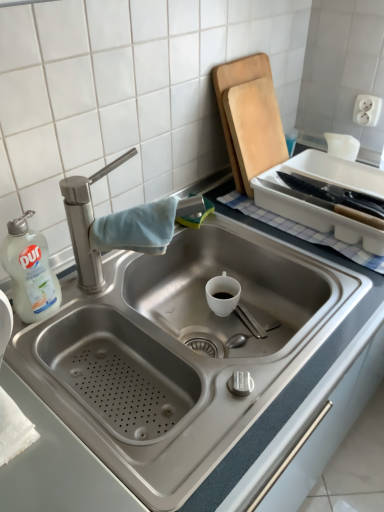
Based on the photo, measure the distance between point (201, 188) and camera.

A distance of 1.21 meters exists between point (201, 188) and camera.

What is the approximate height of white plastic tray at upper right?

white plastic tray at upper right is 3.71 inches tall.

Identify the location of white plastic tray at upper right. (319, 206).

The width and height of the screenshot is (384, 512). Describe the element at coordinates (30, 271) in the screenshot. I see `white plastic bottle at left` at that location.

What do you see at coordinates (249, 117) in the screenshot? I see `wooden cutting board at upper right` at bounding box center [249, 117].

Where is `stainless steel sink at center`? This screenshot has height=512, width=384. stainless steel sink at center is located at coordinates (196, 355).

Would you say white plastic bottle at left is part of wooden cutting board at upper right's contents?

No.

Is wooden cutting board at upper right facing towards white plastic bottle at left?

No, wooden cutting board at upper right does not turn towards white plastic bottle at left.

Looking at this image, in terms of height, does wooden cutting board at upper right look taller or shorter compared to white plastic bottle at left?

Clearly, wooden cutting board at upper right is taller compared to white plastic bottle at left.

The width and height of the screenshot is (384, 512). I want to click on cleaning product below the white plastic tray at upper right (from the image's perspective), so click(x=30, y=271).

Is white plastic bottle at left placed right next to white plastic tray at upper right?

No, white plastic bottle at left is not next to white plastic tray at upper right.

Looking at this image, is white plastic bottle at left looking in the opposite direction of white plastic tray at upper right?

white plastic bottle at left is not turned away from white plastic tray at upper right.

Considering the sizes of objects white plastic bottle at left and white plastic tray at upper right in the image provided, who is shorter, white plastic bottle at left or white plastic tray at upper right?

white plastic tray at upper right.

Is point (71, 335) less distant than point (233, 139)?

Yes, point (71, 335) is closer to viewer.

Considering the sizes of objects stainless steel sink at center and wooden cutting board at upper right in the image provided, who is shorter, stainless steel sink at center or wooden cutting board at upper right?

stainless steel sink at center is shorter.

Does stainless steel sink at center have a lesser width compared to wooden cutting board at upper right?

In fact, stainless steel sink at center might be wider than wooden cutting board at upper right.

Considering the points (314, 149) and (251, 152), which point is behind, point (314, 149) or point (251, 152)?

The point (314, 149) is more distant.

You are a GUI agent. You are given a task and a screenshot of the screen. Output one action in this format:
    pyautogui.click(x=<x>, y=<y>)
    Task: Click on the cutting board behind the white plastic tray at upper right
    
    Given the screenshot: What is the action you would take?
    (249, 117)

From a real-world perspective, between white plastic tray at upper right and wooden cutting board at upper right, who is vertically lower?

white plastic tray at upper right, from a real-world perspective.

Does white plastic tray at upper right appear on the right side of wooden cutting board at upper right?

Yes, white plastic tray at upper right is to the right of wooden cutting board at upper right.

Does stainless steel sink at center appear on the left side of white plastic bottle at left?

Incorrect, stainless steel sink at center is not on the left side of white plastic bottle at left.

From a real-world perspective, is stainless steel sink at center over white plastic bottle at left?

Actually, stainless steel sink at center is physically below white plastic bottle at left in the real world.

The width and height of the screenshot is (384, 512). I want to click on cleaning product on the left side of stainless steel sink at center, so click(x=30, y=271).

Which is in front, point (251, 436) or point (46, 288)?

The point (251, 436) is in front.

In the scene shown: From a real-world perspective, is white plastic bottle at left over wooden cutting board at upper right?

No, from a real-world perspective, white plastic bottle at left is not above wooden cutting board at upper right.

Image resolution: width=384 pixels, height=512 pixels. In the image, there is a white plastic bottle at left. Identify the location of cutting board above it (from the image's perspective). (249, 117).

Are white plastic bottle at left and wooden cutting board at upper right located far from each other?

No, white plastic bottle at left is in close proximity to wooden cutting board at upper right.

Based on the photo, considering the sizes of wooden cutting board at upper right and stainless steel sink at center in the image, is wooden cutting board at upper right taller or shorter than stainless steel sink at center?

wooden cutting board at upper right is taller than stainless steel sink at center.

From the image's perspective, is wooden cutting board at upper right above stainless steel sink at center?

Yes, from the image's perspective, wooden cutting board at upper right is on top of stainless steel sink at center.

Can you see wooden cutting board at upper right touching stainless steel sink at center?

There is a gap between wooden cutting board at upper right and stainless steel sink at center.

Which of these two, wooden cutting board at upper right or stainless steel sink at center, is smaller?

wooden cutting board at upper right.

You are a GUI agent. You are given a task and a screenshot of the screen. Output one action in this format:
    pyautogui.click(x=<x>, y=<y>)
    Task: Click on the cleaning product below the wooden cutting board at upper right (from a real-world perspective)
    The height and width of the screenshot is (512, 384).
    Given the screenshot: What is the action you would take?
    pyautogui.click(x=30, y=271)

In order to click on cleaning product located above the white plastic tray at upper right (from a real-world perspective) in this screenshot , I will do `click(30, 271)`.

Based on the photo, considering their positions, is stainless steel sink at center positioned further to wooden cutting board at upper right than white plastic tray at upper right?

Based on the image, stainless steel sink at center appears to be further to wooden cutting board at upper right.

Considering their positions, is white plastic bottle at left positioned closer to stainless steel sink at center than white plastic tray at upper right?

Among the two, white plastic bottle at left is located nearer to stainless steel sink at center.

Consider the image. Which object lies nearer to the anchor point wooden cutting board at upper right, white plastic bottle at left or stainless steel sink at center?

stainless steel sink at center lies closer to wooden cutting board at upper right than the other object.

Which object lies nearer to the anchor point white plastic tray at upper right, stainless steel sink at center or white plastic bottle at left?

The object closer to white plastic tray at upper right is stainless steel sink at center.

Estimate the real-world distances between objects in this image. Which object is further from stainless steel sink at center, wooden cutting board at upper right or white plastic tray at upper right?

wooden cutting board at upper right.

Consider the image. Which object lies further to the anchor point stainless steel sink at center, white plastic tray at upper right or white plastic bottle at left?

white plastic tray at upper right.

Estimate the real-world distances between objects in this image. Which object is further from white plastic bottle at left, stainless steel sink at center or wooden cutting board at upper right?

wooden cutting board at upper right is positioned further to the anchor white plastic bottle at left.

Estimate the real-world distances between objects in this image. Which object is closer to white plastic bottle at left, white plastic tray at upper right or stainless steel sink at center?

stainless steel sink at center is positioned closer to the anchor white plastic bottle at left.

Find the location of a particular element. sink between white plastic bottle at left and white plastic tray at upper right is located at coordinates (196, 355).

I want to click on cutting board between white plastic bottle at left and white plastic tray at upper right, so click(x=249, y=117).

Image resolution: width=384 pixels, height=512 pixels. What are the coordinates of `appliance between wooden cutting board at upper right and stainless steel sink at center from top to bottom` in the screenshot? It's located at (319, 206).

At what (x,y) coordinates should I click in order to perform the action: click on cleaning product that lies between wooden cutting board at upper right and stainless steel sink at center from top to bottom. Please return your answer as a coordinate pair (x, y). This screenshot has height=512, width=384. Looking at the image, I should click on (30, 271).